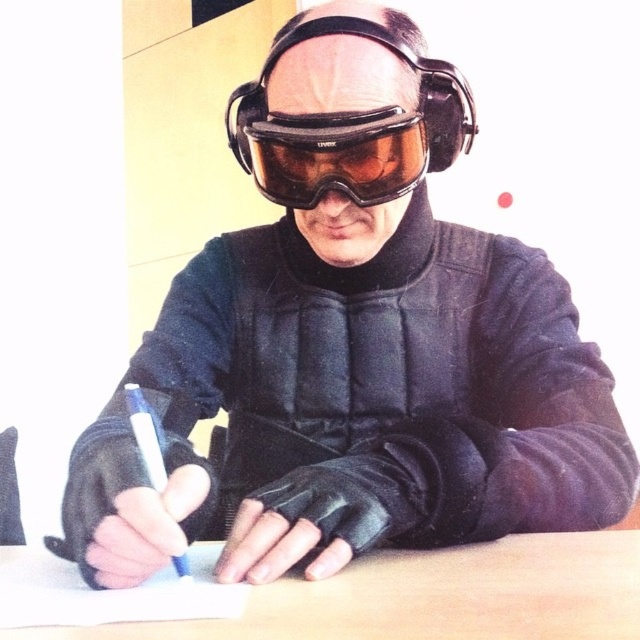
Consider the image. You are a photographer adjusting your camera settings to focus on two points in the image. The points are labeled as point (381, 584) and point (355, 179). Which point should you focus on first to ensure the closest one is sharp?

Point (381, 584) is closer to the viewer than point (355, 179), so you should focus on point (381, 584) first to ensure the closest one is sharp.

You are a delivery drone operator. Your drone is currently above the scene shown. You need to deliver a package to the exact location of the point marked at coordinates point (349, 129). However, there is an object at that location. What object is blocking the delivery location?

The point (349, 129) corresponds to the matte black helmet at center, so the matte black helmet at center is blocking the delivery location.